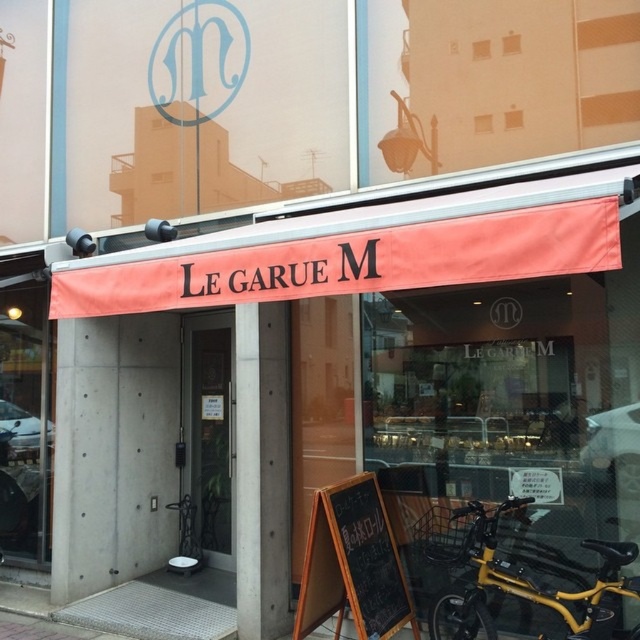
Can you confirm if yellow metallic bicycle at lower right is smaller than black chalkboard at center?

No, yellow metallic bicycle at lower right is not smaller than black chalkboard at center.

What do you see at coordinates (518, 579) in the screenshot? I see `yellow metallic bicycle at lower right` at bounding box center [518, 579].

Between point (512, 573) and point (364, 502), which one is positioned behind?

Point (364, 502)

Identify the location of yellow metallic bicycle at lower right. This screenshot has width=640, height=640. (518, 579).

Which of these two, orange fabric awning at center or yellow metallic bicycle at lower right, stands taller?

orange fabric awning at center is taller.

Can you confirm if orange fabric awning at center is bigger than yellow metallic bicycle at lower right?

Yes, orange fabric awning at center is bigger than yellow metallic bicycle at lower right.

The width and height of the screenshot is (640, 640). Identify the location of orange fabric awning at center. (380, 355).

Is orange fabric awning at center wider than black chalkboard at center?

Yes, orange fabric awning at center is wider than black chalkboard at center.

Locate an element on the screen. The height and width of the screenshot is (640, 640). orange fabric awning at center is located at coordinates (380, 355).

Where is `orange fabric awning at center`? orange fabric awning at center is located at coordinates (x=380, y=355).